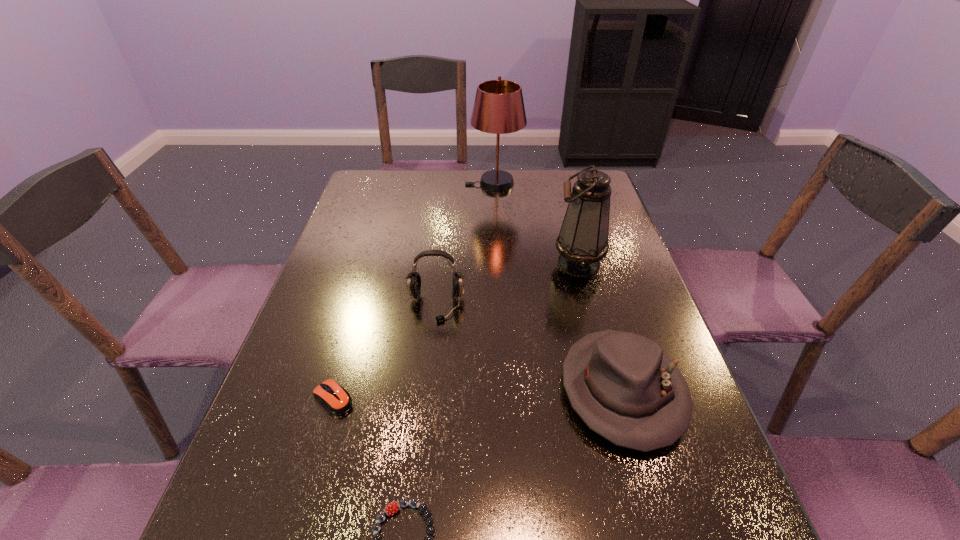
You are a GUI agent. You are given a task and a screenshot of the screen. Output one action in this format:
    pyautogui.click(x=<x>, y=<y>)
    Task: Click on the unoccupied position between the tallest object and the oil lamp
    This screenshot has height=540, width=960.
    Given the screenshot: What is the action you would take?
    pyautogui.click(x=537, y=224)

Identify which object is located as the nearest to the oil lamp. Please provide its 2D coordinates. Your answer should be formatted as a tuple, i.e. [(x, y)], where the tuple contains the x and y coordinates of a point satisfying the conditions above.

[(624, 387)]

Identify which object is the fourth nearest to the hat. Please provide its 2D coordinates. Your answer should be formatted as a tuple, i.e. [(x, y)], where the tuple contains the x and y coordinates of a point satisfying the conditions above.

[(335, 398)]

The height and width of the screenshot is (540, 960). What are the coordinates of `free space that satisfies the following two spatial constraints: 1. on the back side of the second farthest object; 2. on the front-facing side of the farthest object` in the screenshot? It's located at (558, 184).